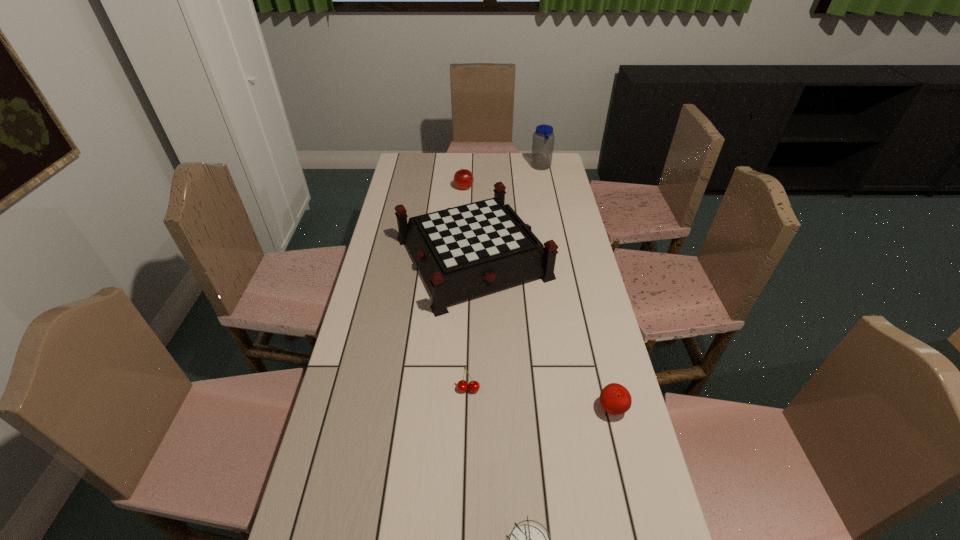
Where is `apple that is at the right edge`? Image resolution: width=960 pixels, height=540 pixels. apple that is at the right edge is located at coordinates click(x=615, y=399).

Where is `object at the far right corner`? object at the far right corner is located at coordinates (543, 138).

This screenshot has width=960, height=540. Identify the location of vacant space at the far edge of the desktop. (508, 154).

You are a GUI agent. You are given a task and a screenshot of the screen. Output one action in this format:
    pyautogui.click(x=<x>, y=<y>)
    Task: Click on the free point at the left edge
    
    Given the screenshot: What is the action you would take?
    pyautogui.click(x=397, y=310)

The image size is (960, 540). I want to click on vacant space at the right edge, so click(x=630, y=457).

Find the location of `vacant area at the far left corner`. vacant area at the far left corner is located at coordinates (421, 153).

Where is `free space between the second nearest object and the fourth nearest object`? The width and height of the screenshot is (960, 540). free space between the second nearest object and the fourth nearest object is located at coordinates (542, 333).

Find the location of a particular element. The height and width of the screenshot is (540, 960). vacant region between the nearer apple and the farthest object is located at coordinates pyautogui.click(x=577, y=288).

Locate an element on the screen. The width and height of the screenshot is (960, 540). empty space that is in between the checkerboard and the nearer apple is located at coordinates (542, 333).

Select which object appears as the fifth closest to the nearest object. Please provide its 2D coordinates. Your answer should be formatted as a tuple, i.e. [(x, y)], where the tuple contains the x and y coordinates of a point satisfying the conditions above.

[(543, 138)]